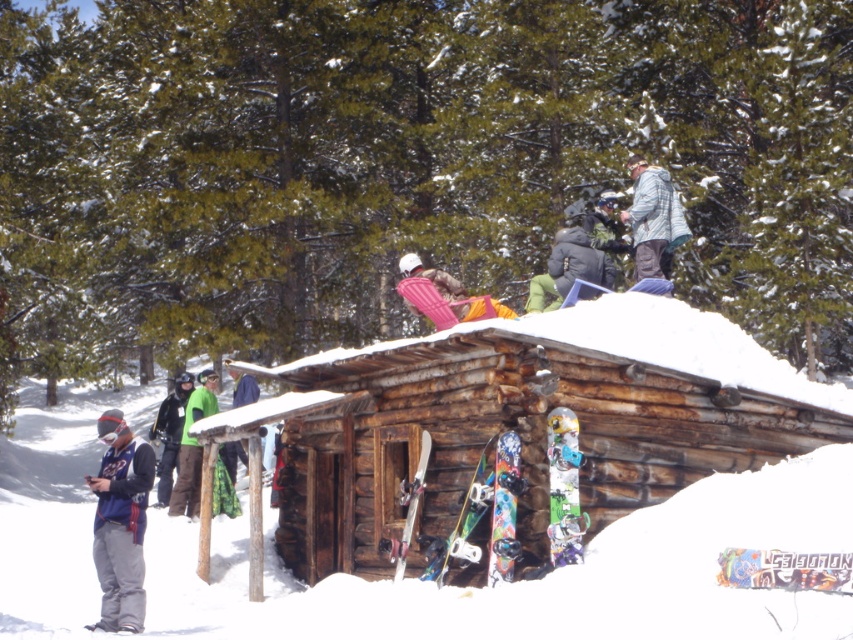
Between point (440, 572) and point (180, 426), which one is positioned behind?

Point (180, 426)

Is multicolored fiberglass snowboard at center positioned before black matte jacket at left?

Yes, it is.

In the scene shown: Who is more forward, (460, 563) or (178, 381)?

Point (460, 563) is in front.

Locate an element on the screen. This screenshot has height=640, width=853. multicolored fiberglass snowboard at center is located at coordinates (468, 516).

Does dark green puffy jacket at upper center appear on the left side of green fabric jacket at center?

In fact, dark green puffy jacket at upper center is to the right of green fabric jacket at center.

Is dark green puffy jacket at upper center positioned at the back of green fabric jacket at center?

Yes, it is behind green fabric jacket at center.

Who is more forward, [579,244] or [241,387]?

Point [579,244] is more forward.

Where is `dark green puffy jacket at upper center`? dark green puffy jacket at upper center is located at coordinates (567, 268).

Is gray fleece jacket at left thinner than multicolored graphic snowboard at center?

Incorrect, gray fleece jacket at left's width is not less than multicolored graphic snowboard at center's.

Is gray fleece jacket at left wider than multicolored graphic snowboard at center?

Indeed, gray fleece jacket at left has a greater width compared to multicolored graphic snowboard at center.

Between point (138, 512) and point (560, 433), which one is positioned in front?

Point (560, 433) is more forward.

This screenshot has height=640, width=853. I want to click on gray fleece jacket at left, so click(120, 524).